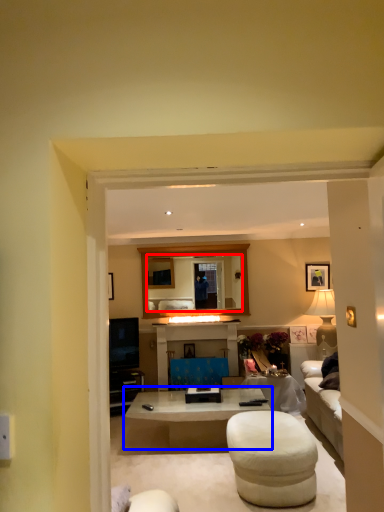
Question: Which object appears closest to the camera in this image, mirror (highlighted by a red box) or coffee table (highlighted by a blue box)?

Choices:
 (A) mirror
 (B) coffee table

Answer: (B)